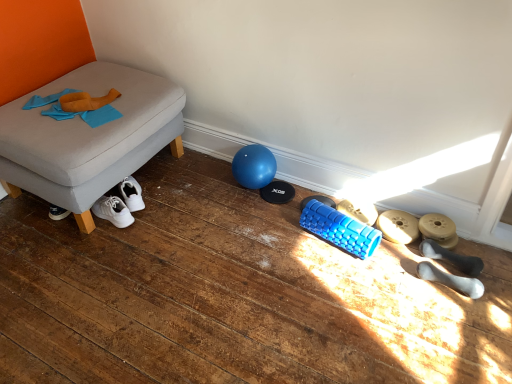
You are a GUI agent. You are given a task and a screenshot of the screen. Output one action in this format:
    pyautogui.click(x=<x>, y=<y>)
    Task: Click on the free space between gray fabric ottoman at left and white rubber dumbbell at lower right, which ranks as the first footwear in front-to-back order
    The image size is (512, 384).
    Given the screenshot: What is the action you would take?
    click(x=242, y=232)